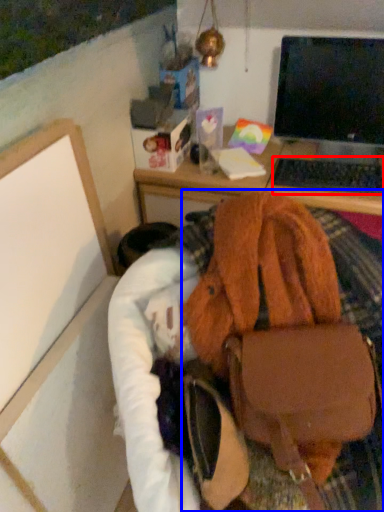
Question: Which point is closer to the camera, computer keyboard (highlighted by a red box) or handbag (highlighted by a blue box)?

Choices:
 (A) computer keyboard
 (B) handbag

Answer: (B)